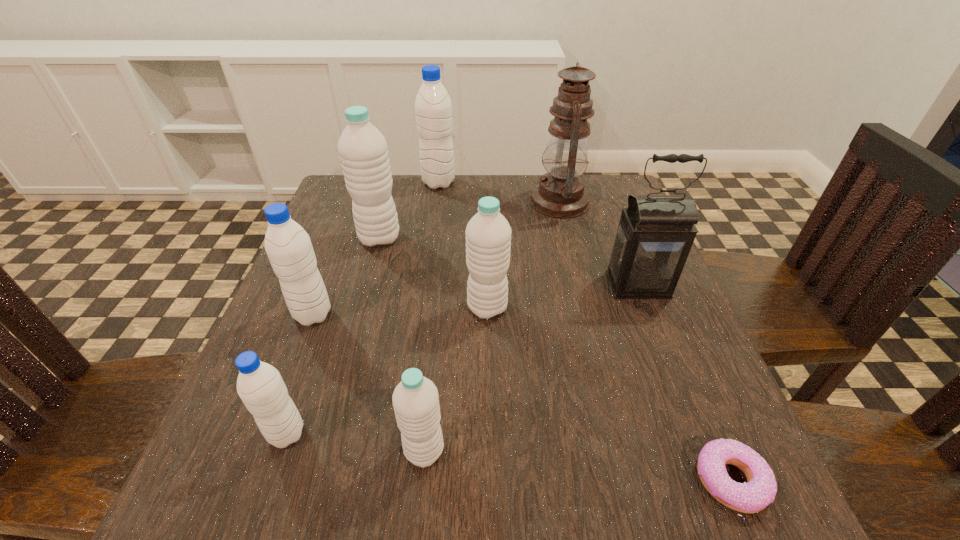
Locate an element on the screen. This screenshot has height=540, width=960. object that is at the far right corner is located at coordinates (560, 193).

Locate an element on the screen. The height and width of the screenshot is (540, 960). object that is at the near right corner is located at coordinates (760, 490).

In order to click on vacant area at the near edge in this screenshot , I will do `click(448, 496)`.

At what (x,y) coordinates should I click in order to perform the action: click on vacant space at the left edge. Please return your answer as a coordinate pair (x, y). The image size is (960, 540). Looking at the image, I should click on (213, 455).

Identify the location of blank space at the right edge. This screenshot has height=540, width=960. (640, 436).

Where is `vacant space at the near left corner`? The width and height of the screenshot is (960, 540). vacant space at the near left corner is located at coordinates (201, 467).

This screenshot has height=540, width=960. Find the location of `free area in between the biggest gray water bottle and the oil lamp`. free area in between the biggest gray water bottle and the oil lamp is located at coordinates (499, 192).

This screenshot has width=960, height=540. I want to click on free space between the nearest white water bottle and the second biggest gray water bottle, so click(369, 382).

The width and height of the screenshot is (960, 540). Find the location of `unoccupied position between the second smallest gray water bottle and the doughnut`. unoccupied position between the second smallest gray water bottle and the doughnut is located at coordinates (522, 399).

At what (x,y) coordinates should I click in order to perform the action: click on free space that is in between the third farthest object and the biggest gray water bottle. Please return your answer as a coordinate pair (x, y). Looking at the image, I should click on (409, 211).